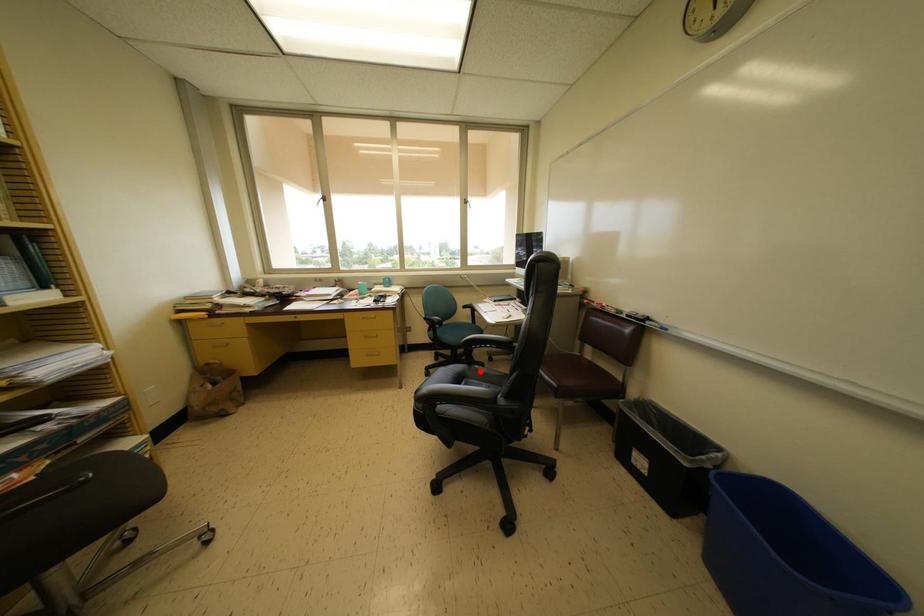
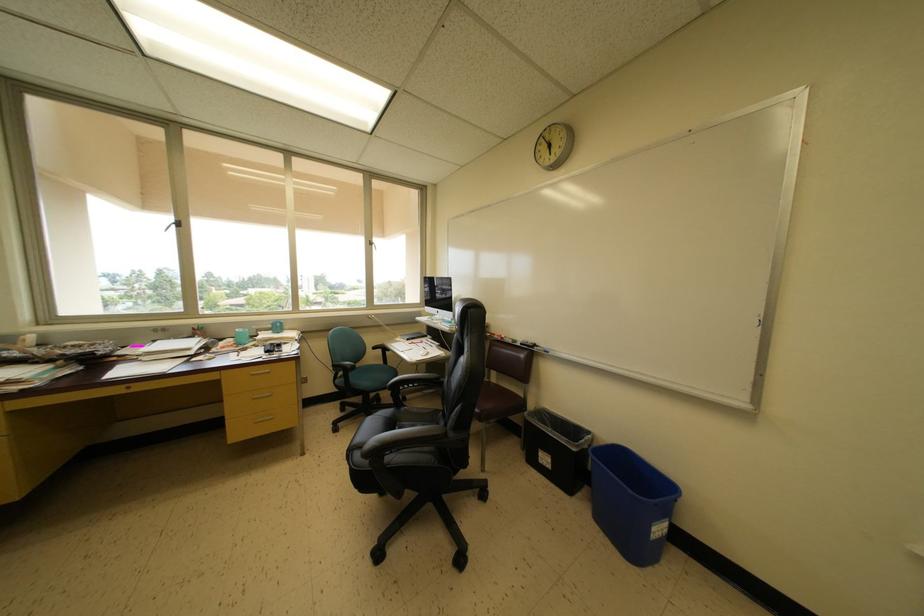
Question: I am providing you with two images of the same scene from different viewpoints. Image1 has a red point marked. In image2, the corresponding 3D location appears at what relative position? Reply with the corresponding letter.

Choices:
 (A) Closer
 (B) Farther

Answer: (B)